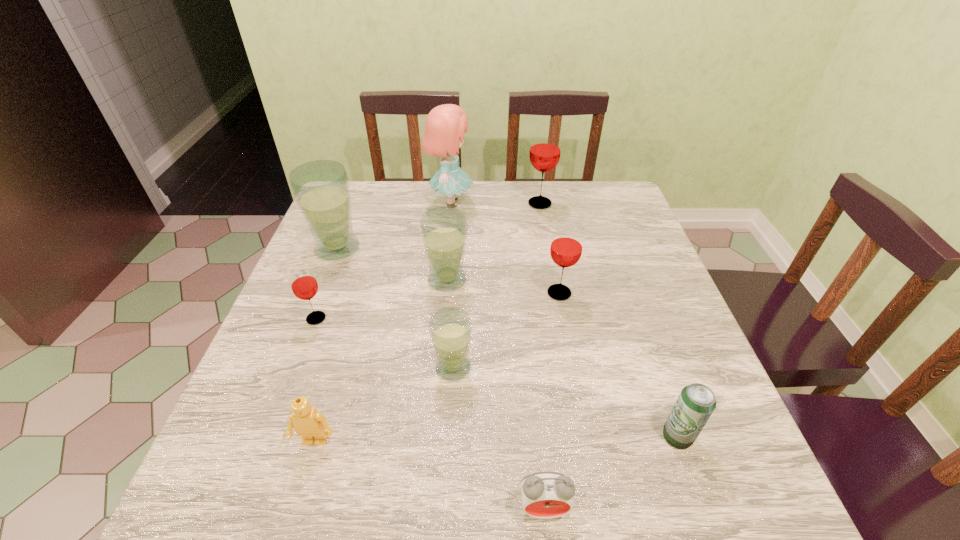
Locate an element on the screen. Image resolution: width=960 pixels, height=540 pixels. the seventh farthest object is located at coordinates (450, 329).

The height and width of the screenshot is (540, 960). Find the location of `the smallest blue glass`. the smallest blue glass is located at coordinates pyautogui.click(x=450, y=329).

Identify the location of the rightmost object. The width and height of the screenshot is (960, 540). (696, 402).

Where is `Lego`? Lego is located at coordinates (308, 423).

Image resolution: width=960 pixels, height=540 pixels. I want to click on red alarm clock, so point(545,495).

Where is `alarm clock`? The image size is (960, 540). alarm clock is located at coordinates (545, 495).

At what (x,y) coordinates should I click in order to perform the action: click on vacant space located 0.390m on the front-facing side of the doll. Please return your answer as a coordinate pair (x, y). Looking at the image, I should click on (603, 202).

You are a GUI agent. You are given a task and a screenshot of the screen. Output one action in this format:
    pyautogui.click(x=<x>, y=<y>)
    Task: Click on the vacant space located on the left of the biggest red glass
    Image resolution: width=960 pixels, height=540 pixels.
    Given the screenshot: What is the action you would take?
    pyautogui.click(x=422, y=204)

The width and height of the screenshot is (960, 540). In order to click on free space located 0.060m on the back of the eighth nearest object in this screenshot , I will do `click(348, 221)`.

The image size is (960, 540). What are the coordinates of `vacant space located on the left of the second smallest red glass` in the screenshot? It's located at (379, 293).